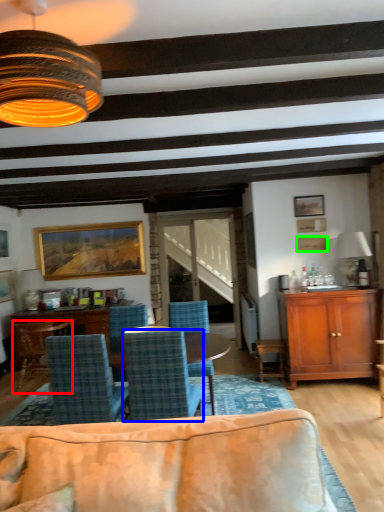
Question: Which is farther away from chair (highlighted by a red box)? chair (highlighted by a blue box) or picture frame (highlighted by a green box)?

Choices:
 (A) chair
 (B) picture frame

Answer: (B)